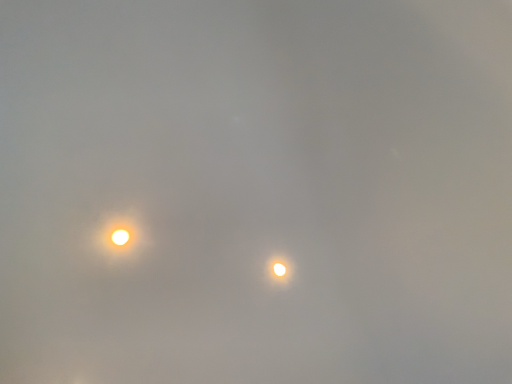
Question: Is point (110, 220) closer or farther from the camera than point (272, 261)?

Choices:
 (A) farther
 (B) closer

Answer: (B)

Question: Would you say bright yellow orb at upper left, which appears as the second moonlight when viewed from the right, is to the left or to the right of bright white sphere at center, which is counted as the first moonlight, starting from the back, in the picture?

Choices:
 (A) left
 (B) right

Answer: (A)

Question: In terms of width, does bright yellow orb at upper left, the 1th moonlight from the left, look wider or thinner when compared to bright white sphere at center, which appears as the second moonlight when viewed from the top?

Choices:
 (A) thin
 (B) wide

Answer: (B)

Question: Considering the positions of point (282, 258) and point (133, 241), is point (282, 258) closer or farther from the camera than point (133, 241)?

Choices:
 (A) farther
 (B) closer

Answer: (A)

Question: In terms of width, does bright white sphere at center, which appears as the second moonlight when viewed from the top, look wider or thinner when compared to bright yellow orb at upper left, the 2th moonlight ordered from the bottom?

Choices:
 (A) wide
 (B) thin

Answer: (B)

Question: From the image's perspective, is bright white sphere at center, arranged as the second moonlight when viewed from the front, positioned above or below bright yellow orb at upper left, which ranks as the 1th moonlight in front-to-back order?

Choices:
 (A) above
 (B) below

Answer: (B)

Question: From a real-world perspective, is bright white sphere at center, the 2th moonlight from the left, positioned above or below bright yellow orb at upper left, the 2th moonlight ordered from the bottom?

Choices:
 (A) above
 (B) below

Answer: (A)